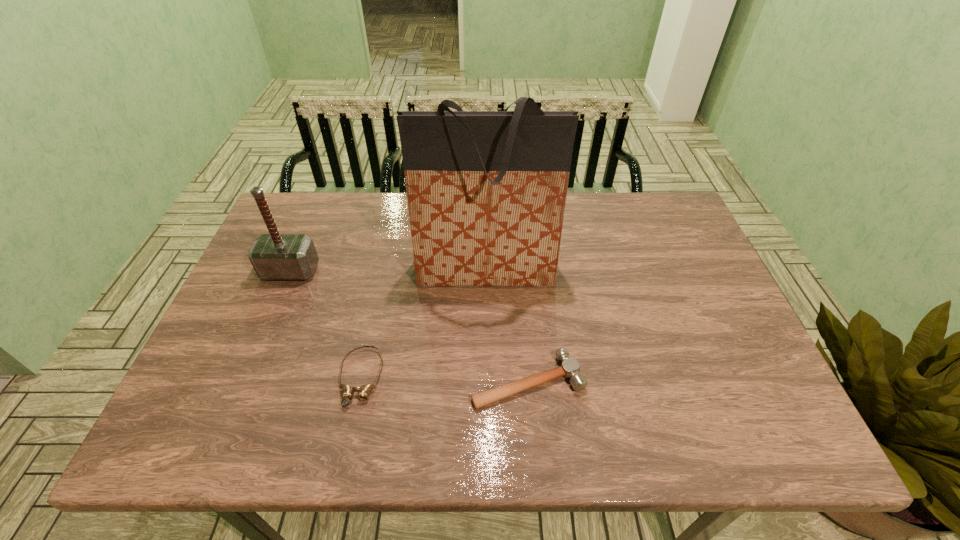
This screenshot has width=960, height=540. I want to click on vacant point located between the third object from right to left and the tallest object, so click(423, 324).

I want to click on free space between the shortest object and the left hammer, so click(x=325, y=324).

Find the location of a particular element. vacant space that's between the tallest object and the third tallest object is located at coordinates (507, 326).

Find the location of `empty space between the goggles and the second shortest object`. empty space between the goggles and the second shortest object is located at coordinates (444, 379).

Where is `empty space between the second shortest object and the leftmost object`? This screenshot has height=540, width=960. empty space between the second shortest object and the leftmost object is located at coordinates (409, 326).

Find the location of a particular element. This screenshot has height=540, width=960. free space that is in between the right hammer and the farther hammer is located at coordinates (409, 326).

The width and height of the screenshot is (960, 540). In order to click on unoccupied position between the tallest object and the taller hammer in this screenshot , I will do pos(388,271).

Locate an element on the screen. vacant area that lies between the shorter hammer and the shortest object is located at coordinates (444, 379).

Locate an element on the screen. Image resolution: width=960 pixels, height=540 pixels. the third closest object relative to the shortest object is located at coordinates (274, 256).

This screenshot has width=960, height=540. Find the location of `object that ranks as the third closest to the third object from right to left`. object that ranks as the third closest to the third object from right to left is located at coordinates (274, 256).